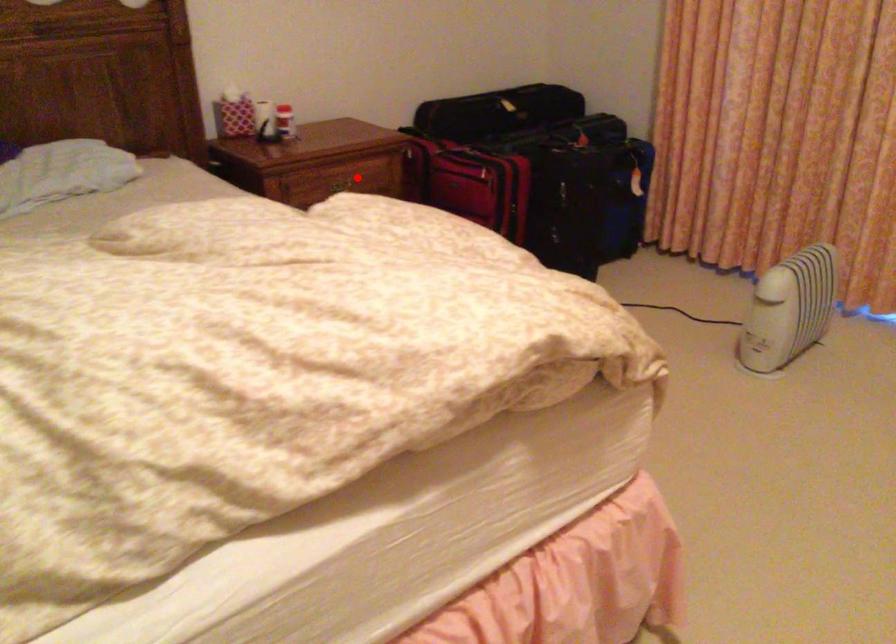
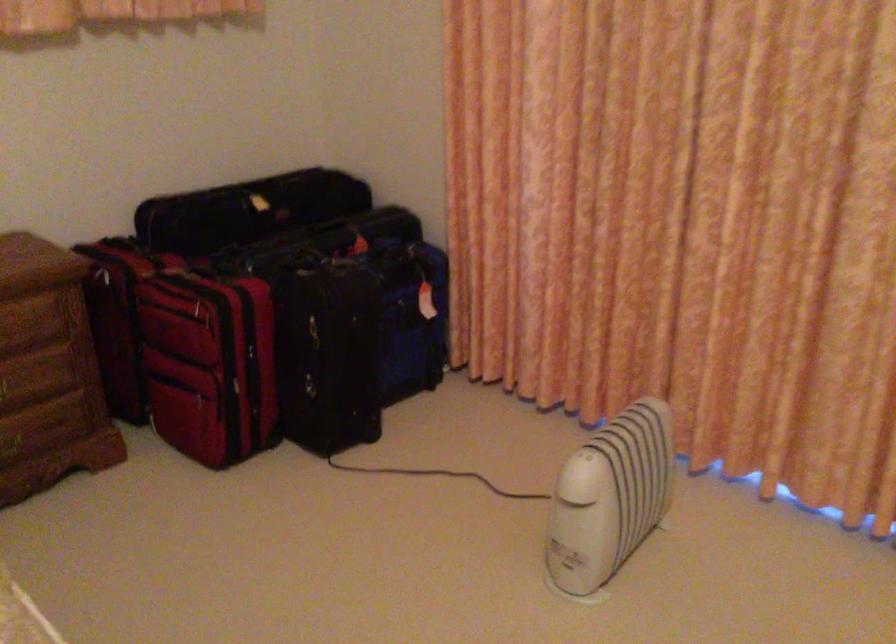
Question: A red point is marked in image1. In image2, is the corresponding 3D point closer to the camera or farther? Reply with the corresponding letter.

Choices:
 (A) The corresponding 3D point is closer.
 (B) The corresponding 3D point is farther.

Answer: (A)